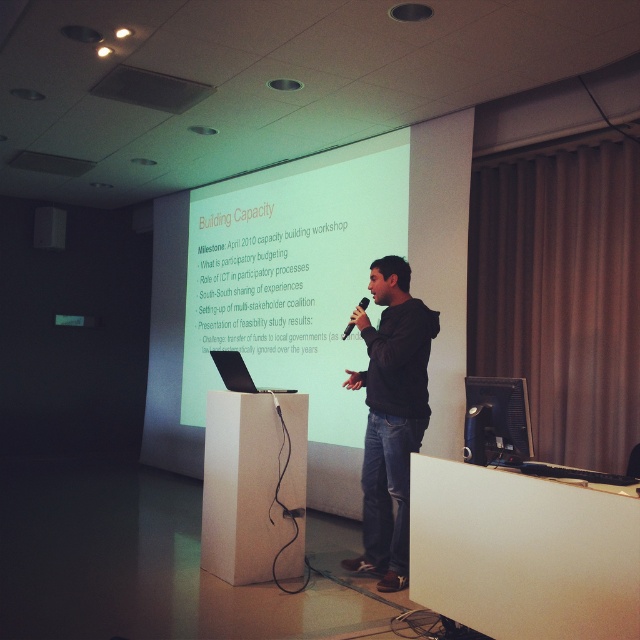
In the scene shown: Is black hoodie at center smaller than black matte microphone at center?

Actually, black hoodie at center might be larger than black matte microphone at center.

Which is in front, point (392, 529) or point (358, 300)?

Positioned in front is point (392, 529).

Locate an element on the screen. This screenshot has height=640, width=640. black hoodie at center is located at coordinates (390, 416).

Can you confirm if black hoodie at center is taller than black matte speaker at center?

Correct, black hoodie at center is much taller as black matte speaker at center.

Does point (372, 349) lie behind point (45, 218)?

That is False.

At what (x,y) coordinates should I click in order to perform the action: click on black hoodie at center. Please return your answer as a coordinate pair (x, y). The width and height of the screenshot is (640, 640). Looking at the image, I should click on [390, 416].

Is point (236, 532) in front of point (371, 387)?

Yes.

Who is positioned more to the right, white cardboard podium at center or black hoodie at center?

Positioned to the right is black hoodie at center.

Where is `white cardboard podium at center`? The height and width of the screenshot is (640, 640). white cardboard podium at center is located at coordinates (241, 486).

The height and width of the screenshot is (640, 640). I want to click on white cardboard podium at center, so click(x=241, y=486).